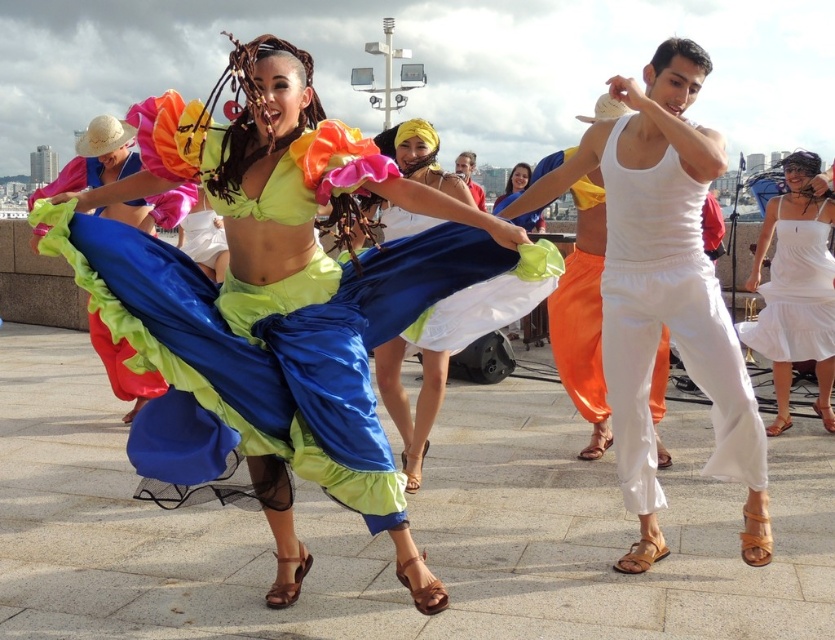
Consider the image. You are a photographer at the dance performance and want to capture a photo where both the shiny satin skirt at center and the matte white dress at center are visible. Which object should you focus on first to ensure both are in frame?

The shiny satin skirt at center is positioned on the left side of the matte white dress at center, so you should focus on the matte white dress at center first to ensure both are in frame.

You are a photographer trying to capture the dance performance. You want to ensure that both the blue satin skirt at center and the matte white dress at center are clearly visible in your shot. Based on their positions, which one should you focus on first to frame them properly?

The blue satin skirt at center is positioned on the left side of matte white dress at center, so you should focus on the blue satin skirt at center first to ensure both are framed properly.

You are a photographer trying to capture the dancers. You notice the blue satin skirt at center and the matte white dress at center. Which one is closer to the camera?

The blue satin skirt at center is closer to the camera because it is in front of the matte white dress at center.